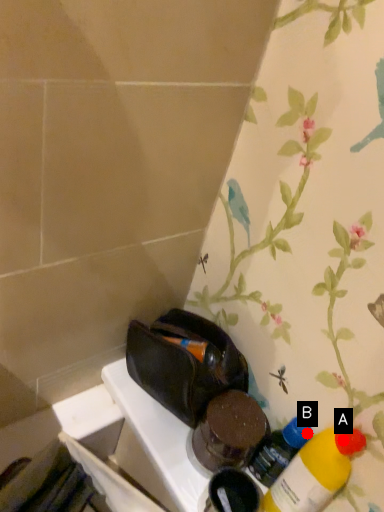
Question: Two points are circled on the image, labeled by A and B beside each circle. Which of the following is the farthest from the observer?

Choices:
 (A) A is further
 (B) B is further

Answer: (B)